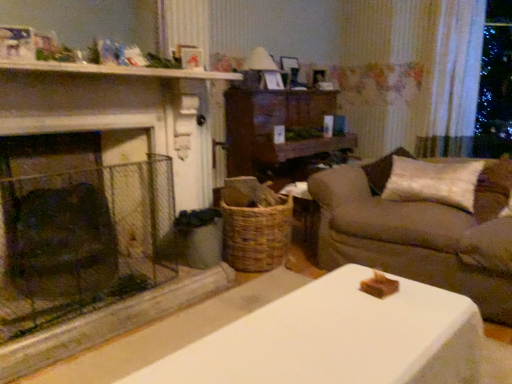
Question: From the image's perspective, is beige fabric couch at right beneath white painted wood mantle at upper center?

Choices:
 (A) no
 (B) yes

Answer: (B)

Question: Considering the relative sizes of beige fabric couch at right and white painted wood mantle at upper center in the image provided, is beige fabric couch at right thinner than white painted wood mantle at upper center?

Choices:
 (A) no
 (B) yes

Answer: (A)

Question: Is beige fabric couch at right aimed at white painted wood mantle at upper center?

Choices:
 (A) yes
 (B) no

Answer: (B)

Question: Is beige fabric couch at right to the left of white painted wood mantle at upper center from the viewer's perspective?

Choices:
 (A) yes
 (B) no

Answer: (B)

Question: Is there a large distance between beige fabric couch at right and white painted wood mantle at upper center?

Choices:
 (A) no
 (B) yes

Answer: (B)

Question: Is woven brown basket at center taller or shorter than white sheer curtain at upper right?

Choices:
 (A) short
 (B) tall

Answer: (A)

Question: Considering the positions of woven brown basket at center and white sheer curtain at upper right in the image, is woven brown basket at center wider or thinner than white sheer curtain at upper right?

Choices:
 (A) thin
 (B) wide

Answer: (B)

Question: Does point (246, 249) appear closer or farther from the camera than point (437, 57)?

Choices:
 (A) closer
 (B) farther

Answer: (A)

Question: Considering their positions, is woven brown basket at center located in front of or behind white sheer curtain at upper right?

Choices:
 (A) front
 (B) behind

Answer: (A)

Question: From their relative heights in the image, would you say white painted wood mantle at upper center is taller or shorter than matte white lampshade at upper center?

Choices:
 (A) short
 (B) tall

Answer: (A)

Question: From a real-world perspective, is white painted wood mantle at upper center positioned above or below matte white lampshade at upper center?

Choices:
 (A) above
 (B) below

Answer: (B)

Question: Would you say white painted wood mantle at upper center is to the left or to the right of matte white lampshade at upper center in the picture?

Choices:
 (A) right
 (B) left

Answer: (B)

Question: Relative to matte white lampshade at upper center, is white painted wood mantle at upper center in front or behind?

Choices:
 (A) behind
 (B) front

Answer: (B)

Question: Visually, is woven brown basket at center positioned to the left or to the right of matte white lampshade at upper center?

Choices:
 (A) right
 (B) left

Answer: (B)

Question: Considering the positions of woven brown basket at center and matte white lampshade at upper center in the image, is woven brown basket at center taller or shorter than matte white lampshade at upper center?

Choices:
 (A) tall
 (B) short

Answer: (A)